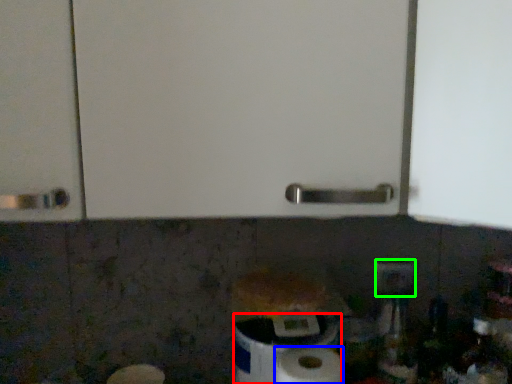
Question: Based on their relative distances, which object is farther from toilet paper (highlighted by a red box)? Choose from paper towel (highlighted by a blue box) and electric outlet (highlighted by a green box).

Choices:
 (A) paper towel
 (B) electric outlet

Answer: (B)